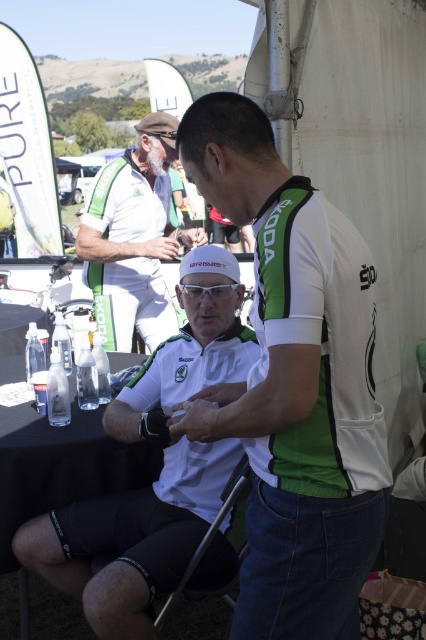
Identify the location of white matte jersey at center. (294, 385).

Looking at this image, can you confirm if white matte jersey at center is positioned to the right of black fabric table at lower center?

Correct, you'll find white matte jersey at center to the right of black fabric table at lower center.

Image resolution: width=426 pixels, height=640 pixels. Identify the location of white matte jersey at center. (294, 385).

Does white matte cycling jersey at center have a greater height compared to white matte shirt at upper center?

No, white matte cycling jersey at center is not taller than white matte shirt at upper center.

Identify the location of white matte cycling jersey at center. (132, 538).

Can you confirm if black fabric table at lower center is taller than black fabric folding chair at lower center?

Correct, black fabric table at lower center is much taller as black fabric folding chair at lower center.

Is point (94, 452) behind point (198, 557)?

Yes.

From the picture: Who is more distant from viewer, [23,372] or [210,540]?

Positioned behind is point [23,372].

This screenshot has width=426, height=640. In order to click on black fabric table at lower center in this screenshot , I will do `click(62, 467)`.